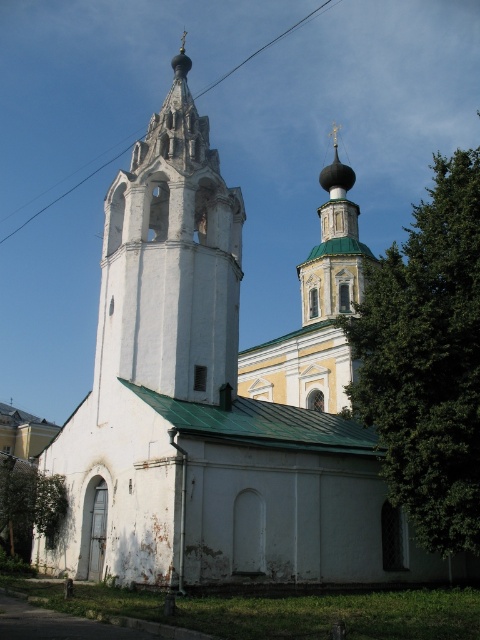
Question: Which is farther from the green wooden bell tower at upper center?

Choices:
 (A) black wire at upper center
 (B) white stone bell tower at center
 (C) green leafy tree at upper right
 (D) green leafy tree at lower left

Answer: (A)

Question: Can you confirm if green leafy tree at lower left is positioned to the left of black wire at upper center?

Choices:
 (A) no
 (B) yes

Answer: (A)

Question: Which of the following is the closest to the observer?

Choices:
 (A) (205, 88)
 (B) (26, 545)
 (C) (406, 486)

Answer: (C)

Question: Is green wooden bell tower at upper center to the right of green leafy tree at lower left from the viewer's perspective?

Choices:
 (A) yes
 (B) no

Answer: (A)

Question: Can you confirm if green leafy tree at upper right is positioned below green leafy tree at lower left?

Choices:
 (A) no
 (B) yes

Answer: (A)

Question: Among these points, which one is farthest from the camera?

Choices:
 (A) (334, 180)
 (B) (86, 177)

Answer: (B)